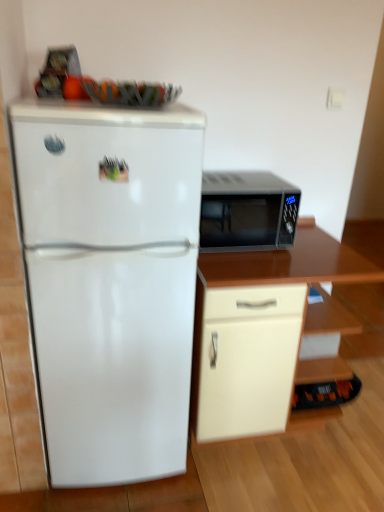
At what (x,y) coordinates should I click in order to perform the action: click on white glossy refrigerator at left. Please return your answer as a coordinate pair (x, y). Looking at the image, I should click on (109, 282).

Does white glossy refrigerator at left have a larger size compared to matte black microwave at right?

Correct, white glossy refrigerator at left is larger in size than matte black microwave at right.

From the image's perspective, between white glossy refrigerator at left and matte black microwave at right, who is located below?

white glossy refrigerator at left appears lower in the image.

Measure the distance from white glossy refrigerator at left to matte black microwave at right.

The distance of white glossy refrigerator at left from matte black microwave at right is 18.90 inches.

Which of these two, white glossy refrigerator at left or matte black microwave at right, stands shorter?

matte black microwave at right is shorter.

Between beige matte cabinet at lower right and white glossy refrigerator at left, which one has less height?

With less height is beige matte cabinet at lower right.

Is beige matte cabinet at lower right to the left or to the right of white glossy refrigerator at left in the image?

beige matte cabinet at lower right is positioned on white glossy refrigerator at left's right side.

From the image's perspective, between beige matte cabinet at lower right and white glossy refrigerator at left, which one is located above?

white glossy refrigerator at left, from the image's perspective.

Find the location of a particular element. cabinetry behind the white glossy refrigerator at left is located at coordinates (258, 330).

Looking at this image, from a real-world perspective, who is located lower, beige matte cabinet at lower right or matte black microwave at right?

beige matte cabinet at lower right, from a real-world perspective.

Consider the image. Is beige matte cabinet at lower right wider than matte black microwave at right?

Indeed, beige matte cabinet at lower right has a greater width compared to matte black microwave at right.

Is beige matte cabinet at lower right not within matte black microwave at right?

Indeed, beige matte cabinet at lower right is completely outside matte black microwave at right.

How much distance is there between white glossy refrigerator at left and beige matte cabinet at lower right?

white glossy refrigerator at left is 14.21 inches away from beige matte cabinet at lower right.

Is there a large distance between white glossy refrigerator at left and beige matte cabinet at lower right?

No, white glossy refrigerator at left is in close proximity to beige matte cabinet at lower right.

Is white glossy refrigerator at left looking in the opposite direction of beige matte cabinet at lower right?

No, white glossy refrigerator at left's orientation is not away from beige matte cabinet at lower right.

From the image's perspective, which object appears higher, white glossy refrigerator at left or beige matte cabinet at lower right?

white glossy refrigerator at left.

Is matte black microwave at right oriented towards white glossy refrigerator at left?

No, matte black microwave at right is not aimed at white glossy refrigerator at left.

From the picture: Is matte black microwave at right next to white glossy refrigerator at left?

matte black microwave at right and white glossy refrigerator at left are clearly separated.

Between matte black microwave at right and white glossy refrigerator at left, which one has larger size?

Bigger between the two is white glossy refrigerator at left.

From the image's perspective, is matte black microwave at right positioned above or below white glossy refrigerator at left?

matte black microwave at right is situated higher than white glossy refrigerator at left in the image.

Is matte black microwave at right to the left of beige matte cabinet at lower right from the viewer's perspective?

Yes.

Who is taller, matte black microwave at right or beige matte cabinet at lower right?

Standing taller between the two is beige matte cabinet at lower right.

From a real-world perspective, between matte black microwave at right and beige matte cabinet at lower right, who is vertically higher?

From a 3D spatial view, matte black microwave at right is above.

Does point (229, 228) lie behind point (294, 329)?

Yes, it is.

Where is `microwave oven above the white glossy refrigerator at left (from a real-world perspective)`? The image size is (384, 512). microwave oven above the white glossy refrigerator at left (from a real-world perspective) is located at coordinates (247, 211).

Where is `cabinetry behind the white glossy refrigerator at left`? cabinetry behind the white glossy refrigerator at left is located at coordinates (258, 330).

Considering their positions, is matte black microwave at right positioned closer to white glossy refrigerator at left than beige matte cabinet at lower right?

beige matte cabinet at lower right lies closer to white glossy refrigerator at left than the other object.

Looking at the image, which one is located further to matte black microwave at right, white glossy refrigerator at left or beige matte cabinet at lower right?

white glossy refrigerator at left lies further to matte black microwave at right than the other object.

Looking at the image, which one is located closer to white glossy refrigerator at left, beige matte cabinet at lower right or matte black microwave at right?

Based on the image, beige matte cabinet at lower right appears to be nearer to white glossy refrigerator at left.

Looking at the image, which one is located further to matte black microwave at right, beige matte cabinet at lower right or white glossy refrigerator at left?

Among the two, white glossy refrigerator at left is located further to matte black microwave at right.

From the image, which object appears to be nearer to beige matte cabinet at lower right, matte black microwave at right or white glossy refrigerator at left?

The object closer to beige matte cabinet at lower right is matte black microwave at right.

When comparing their distances from beige matte cabinet at lower right, does white glossy refrigerator at left or matte black microwave at right seem further?

white glossy refrigerator at left.

Locate an element on the screen. This screenshot has height=512, width=384. microwave oven between white glossy refrigerator at left and beige matte cabinet at lower right is located at coordinates (247, 211).